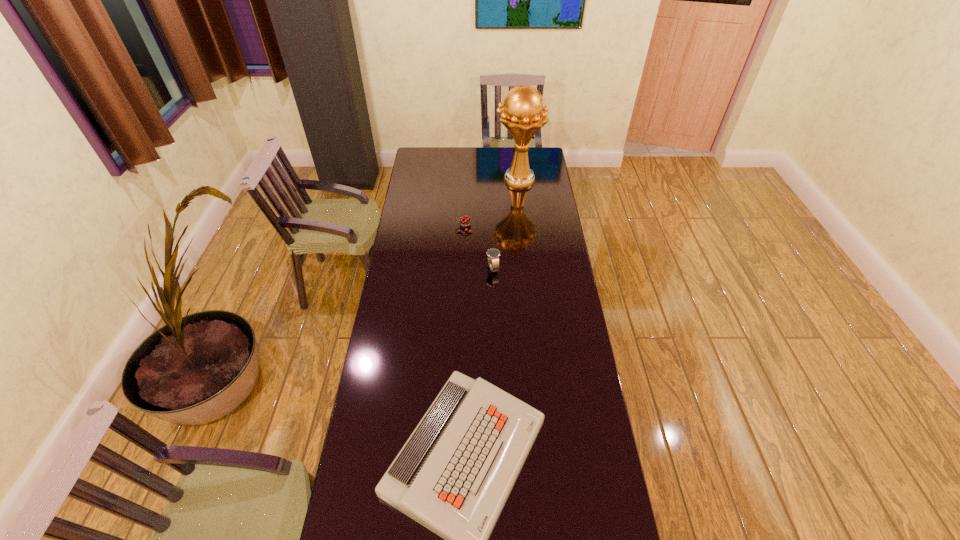
This screenshot has height=540, width=960. Find the location of `trophy_cup`. trophy_cup is located at coordinates (523, 114).

You are a GUI agent. You are given a task and a screenshot of the screen. Output one action in this format:
    pyautogui.click(x=<x>, y=<y>)
    Task: Click on the farthest object
    Image resolution: width=960 pixels, height=540 pixels.
    Given the screenshot: What is the action you would take?
    pyautogui.click(x=523, y=114)

The image size is (960, 540). Find the location of `the third farthest object`. the third farthest object is located at coordinates (493, 254).

Where is `cherry`? cherry is located at coordinates (465, 222).

Locate an element on the screen. This screenshot has width=960, height=540. vacant space located 0.090m at the front of the trophy_cup where the globe is prominent is located at coordinates (478, 179).

Locate an element on the screen. The height and width of the screenshot is (540, 960). free space located at the front of the trophy_cup where the globe is prominent is located at coordinates (471, 179).

You are a GUI agent. You are given a task and a screenshot of the screen. Output one action in this format:
    pyautogui.click(x=<x>, y=<y>)
    Task: Click on the free space located at the front of the trophy_cup where the globe is prominent
    This screenshot has width=960, height=540.
    Given the screenshot: What is the action you would take?
    click(484, 179)

The image size is (960, 540). I want to click on vacant area situated 0.090m on the back of the watch, so click(492, 247).

Identify the location of vacant space situated on the handle side of the cherry. (445, 228).

Where is `vacant space located 0.080m on the handle side of the cherry`? The height and width of the screenshot is (540, 960). vacant space located 0.080m on the handle side of the cherry is located at coordinates (439, 228).